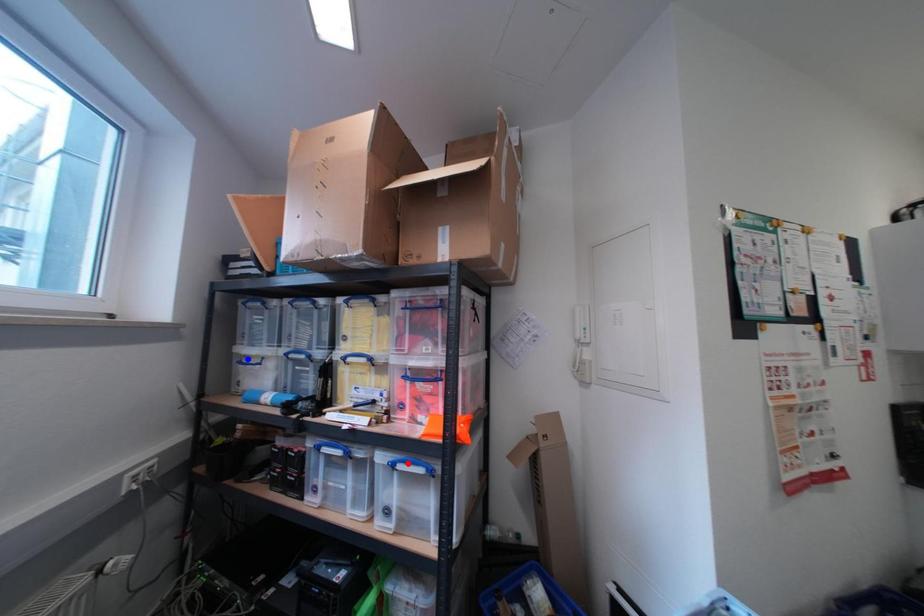
Question: Which of the two points in the image is closer to the camera?

Choices:
 (A) Blue point is closer.
 (B) Red point is closer.

Answer: (B)